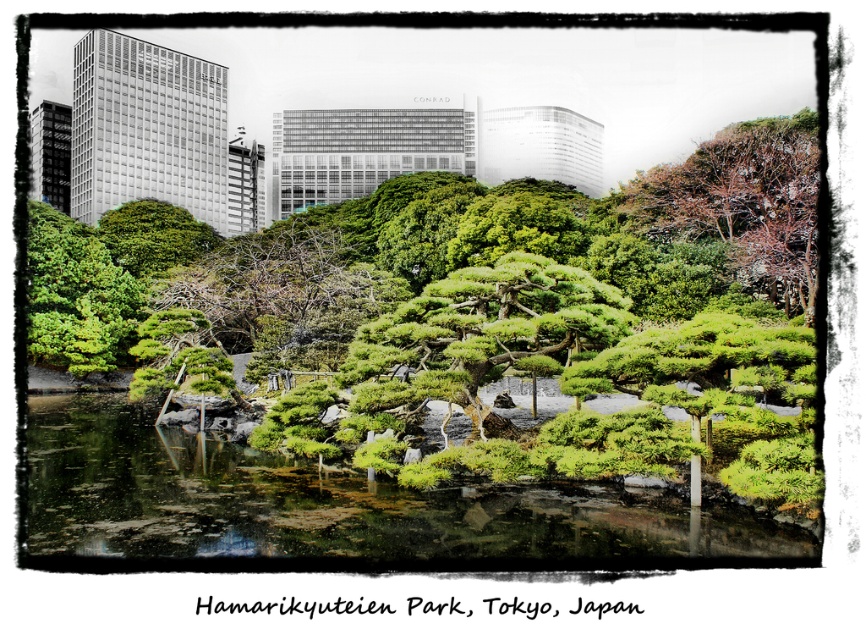
Question: Is the position of green mossy water at lower center less distant than that of green textured tree at center?

Choices:
 (A) no
 (B) yes

Answer: (B)

Question: Which point is closer to the camera?

Choices:
 (A) brown textured tree at upper right
 (B) green textured tree at center
 (C) green textured bonsai tree at center

Answer: (C)

Question: Does green mossy water at lower center lie in front of brown textured tree at upper right?

Choices:
 (A) no
 (B) yes

Answer: (B)

Question: Which of the following is the farthest from the observer?

Choices:
 (A) green textured bonsai tree at center
 (B) green mossy water at lower center
 (C) brown textured tree at upper right

Answer: (C)

Question: Which point is closer to the camera taking this photo?

Choices:
 (A) (412, 342)
 (B) (702, 200)

Answer: (A)

Question: Can you confirm if green textured bonsai tree at center is thinner than brown textured tree at upper right?

Choices:
 (A) no
 (B) yes

Answer: (A)